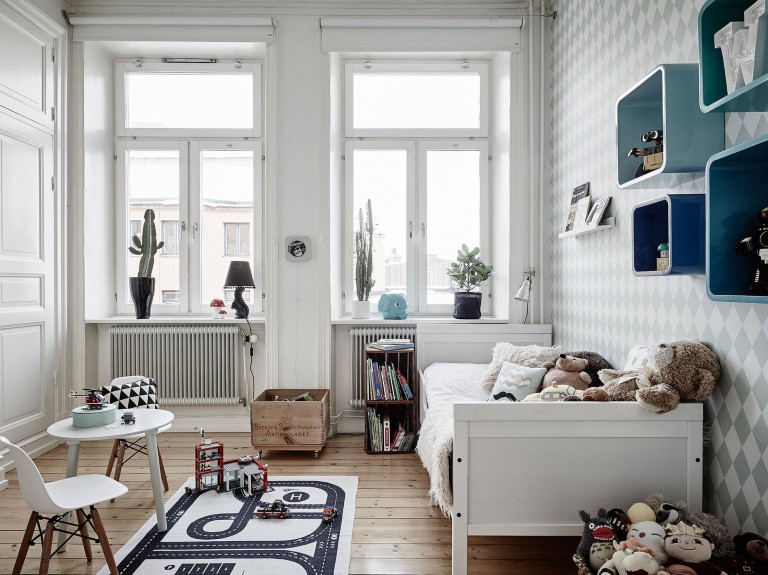
You are a GUI agent. You are given a task and a screenshot of the screen. Output one action in this format:
    pyautogui.click(x=<x>, y=<y>)
    Task: Click on the white double windows
    
    Given the screenshot: What is the action you would take?
    [202, 237], [421, 222]